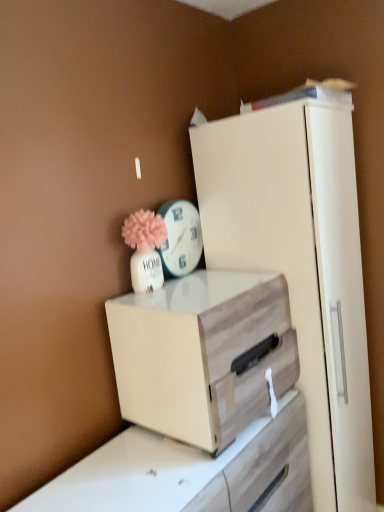
Identify the location of free point above wooden chest of drawers at center (from a real-world perspective). (201, 286).